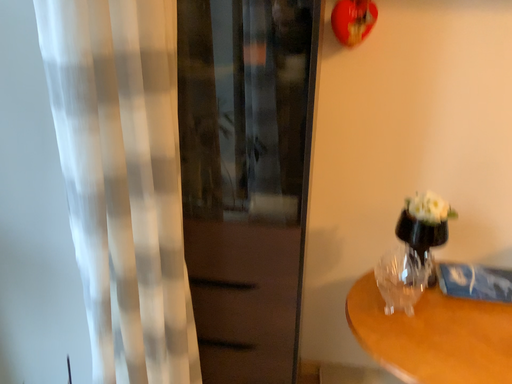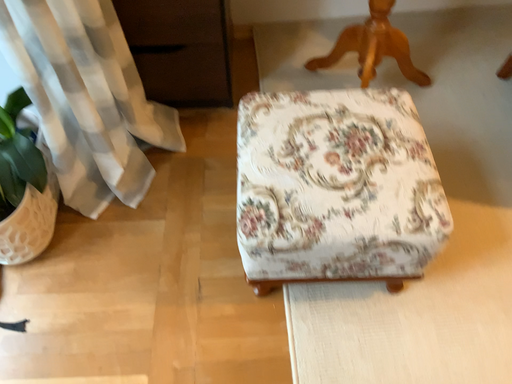
Question: How did the camera likely rotate when shooting the video?

Choices:
 (A) rotated downward
 (B) rotated upward

Answer: (A)